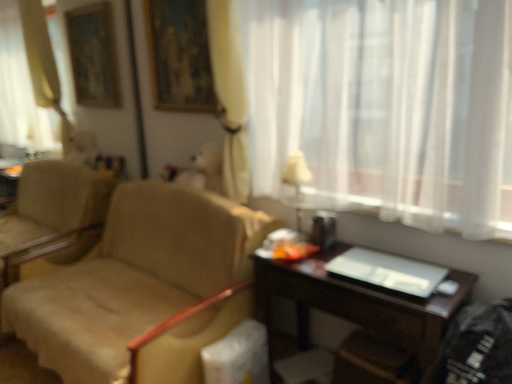
Question: From the image's perspective, relative to wooden picture frame at upper center, is dark wood desk at lower right above or below?

Choices:
 (A) above
 (B) below

Answer: (B)

Question: Is point (337, 249) closer or farther from the camera than point (163, 51)?

Choices:
 (A) farther
 (B) closer

Answer: (B)

Question: Which is farther from the wooden picture frame at upper center?

Choices:
 (A) white fabric lampshade at upper center
 (B) white plastic laptop at right
 (C) dark wood desk at lower right
 (D) beige fabric chair at left
 (E) white sheer curtain at upper right

Answer: (B)

Question: Estimate the real-world distances between objects in this image. Which object is farther from the wooden picture frame at upper center?

Choices:
 (A) white sheer curtain at upper right
 (B) dark wood desk at lower right
 (C) white plastic laptop at right
 (D) white fabric lampshade at upper center
 (E) beige fabric chair at left

Answer: (C)